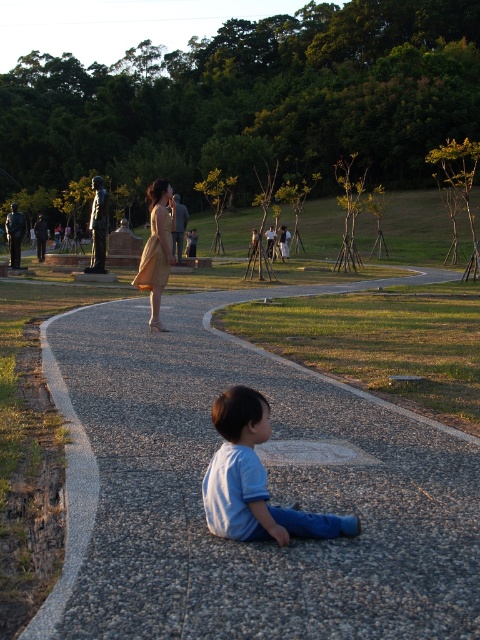
Question: Among these objects, which one is nearest to the camera?

Choices:
 (A) matte beige dress at center
 (B) light beige fabric dress at center

Answer: (B)

Question: Which of the following is the closest to the observer?

Choices:
 (A) light blue cotton shirt at lower center
 (B) matte beige dress at center
 (C) gray gravel path at lower center
 (D) light beige fabric dress at center

Answer: (C)

Question: Observing the image, what is the correct spatial positioning of light blue cotton shirt at lower center in reference to matte beige dress at center?

Choices:
 (A) right
 (B) left

Answer: (A)

Question: Can you confirm if gray gravel path at lower center is bigger than light beige fabric dress at center?

Choices:
 (A) no
 (B) yes

Answer: (A)

Question: Which is nearer to the gray gravel path at lower center?

Choices:
 (A) light blue cotton shirt at lower center
 (B) light beige fabric dress at center
 (C) matte beige dress at center

Answer: (A)

Question: Is gray gravel path at lower center below light beige fabric dress at center?

Choices:
 (A) no
 (B) yes

Answer: (B)